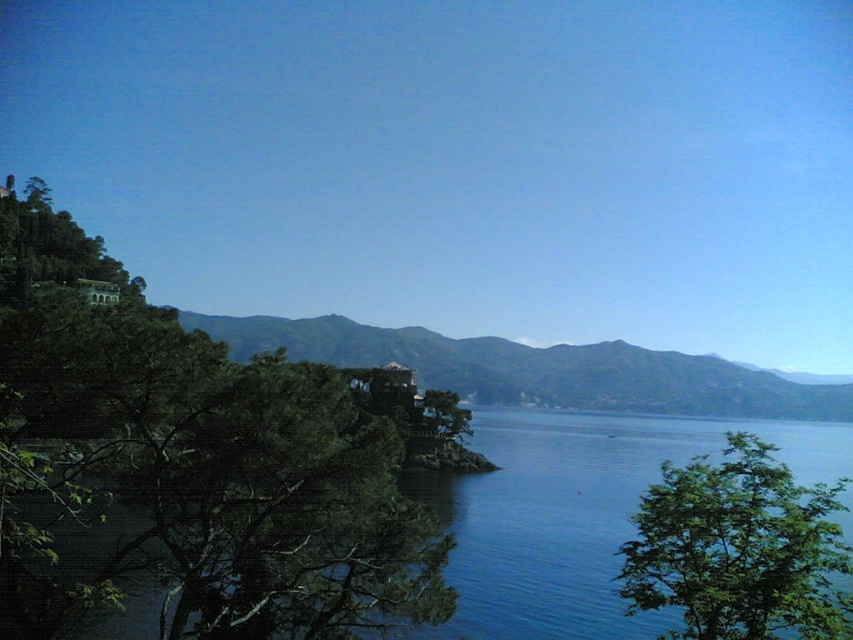
Looking at this image, you are standing at point A which is at the coordinates point (795, 624). You want to walk to point B which is at coordinates point (221, 403). Which direction should you move to reach point B from point A?

Answer: To reach point B at coordinates point (221, 403) from point A at point (795, 624), you should move towards the lower left direction since point B is behind point A in the image.

Consider the image. You are standing at the lakeside and want to walk from the green leafy tree at left to the green matte hillside at center. Which direction should you head to reach the hillside from the tree?

You should head to the right to reach the green matte hillside at center from the green leafy tree at left since the tree is to the left of the hillside.

You are planning to set up a picnic area in the lakeside scene. You have a large picnic blanket that needs space. Which location would be better between the green leafy tree at left and the green matte hillside at center?

The green matte hillside at center would be better for setting up the picnic area because it occupies more space than the green leafy tree at left, providing a larger area for the blanket.